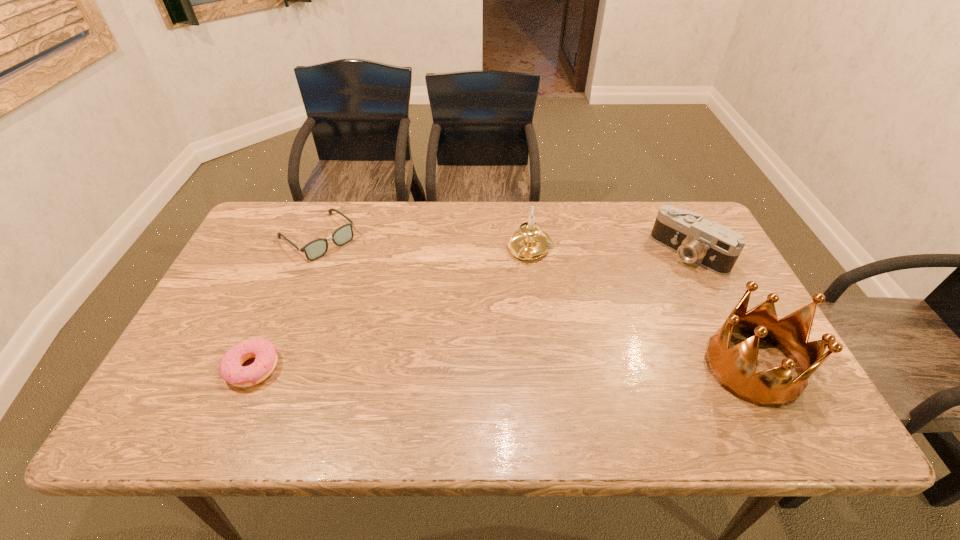
Where is `vacant space situated 0.150m on the handle side of the fourth shortest object`? vacant space situated 0.150m on the handle side of the fourth shortest object is located at coordinates (500, 300).

This screenshot has width=960, height=540. In order to click on vacant area situated 0.300m on the face of the second shortest object in this screenshot , I will do `click(398, 313)`.

The height and width of the screenshot is (540, 960). In order to click on blank space located on the face of the second shortest object in this screenshot , I will do click(379, 294).

You are a GUI agent. You are given a task and a screenshot of the screen. Output one action in this format:
    pyautogui.click(x=<x>, y=<y>)
    Task: Click on the vacant area situated on the face of the second shortest object
    Image resolution: width=960 pixels, height=540 pixels.
    Given the screenshot: What is the action you would take?
    pyautogui.click(x=388, y=302)

You are a GUI agent. You are given a task and a screenshot of the screen. Output one action in this format:
    pyautogui.click(x=<x>, y=<y>)
    Task: Click on the vacant space located 0.330m on the lens of the camera
    This screenshot has width=960, height=540.
    Given the screenshot: What is the action you would take?
    pos(607,331)

In order to click on vacant space located 0.400m on the lens of the camera in this screenshot , I will do `click(589, 347)`.

At what (x,y) coordinates should I click in order to perform the action: click on vacant space located 0.090m on the lens of the camera. Please return your answer as a coordinate pair (x, y). Looking at the image, I should click on (657, 284).

This screenshot has height=540, width=960. What are the coordinates of `candle holder situated at the far edge` in the screenshot? It's located at (530, 242).

Locate an element on the screen. Image resolution: width=960 pixels, height=540 pixels. spectacles that is at the far edge is located at coordinates (315, 249).

The image size is (960, 540). I want to click on camera that is at the far edge, so click(x=715, y=247).